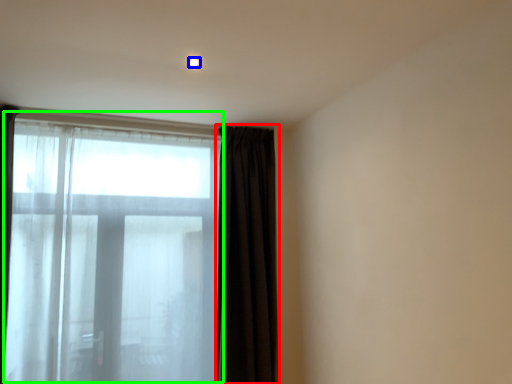
Question: Which is nearer to the curtain (highlighted by a red box)? light (highlighted by a blue box) or bay window (highlighted by a green box).

Choices:
 (A) light
 (B) bay window

Answer: (B)